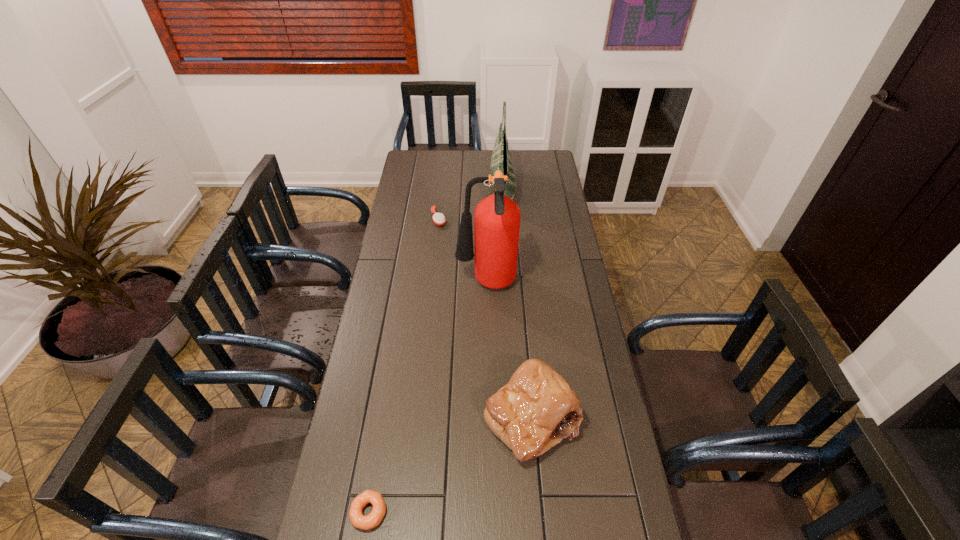
This screenshot has height=540, width=960. Find the location of `free point at the far left corner`. free point at the far left corner is located at coordinates (427, 157).

In the image, there is a desktop. Identify the location of free space at the far right corner. (551, 159).

Find the location of a particular element. Image resolution: width=960 pixels, height=540 pixels. free space between the tote bag and the fourth farthest object is located at coordinates (517, 305).

In order to click on vacant area between the fourth object from right to left and the bread in this screenshot , I will do `click(485, 318)`.

Find the location of a particular element. blank region between the third tallest object and the tote bag is located at coordinates (517, 305).

I want to click on free area in between the third farthest object and the leftmost object, so click(x=427, y=398).

Locate an element on the screen. vacant space in between the third nearest object and the fourth farthest object is located at coordinates (509, 351).

The height and width of the screenshot is (540, 960). Find the location of `free space that is in between the hairbrush and the doughnut`. free space that is in between the hairbrush and the doughnut is located at coordinates (404, 366).

The image size is (960, 540). In order to click on vacant space in between the leftmost object and the fire extinguisher in this screenshot , I will do `click(427, 398)`.

Locate an element on the screen. unoccupied area between the second nearest object and the tote bag is located at coordinates (517, 305).